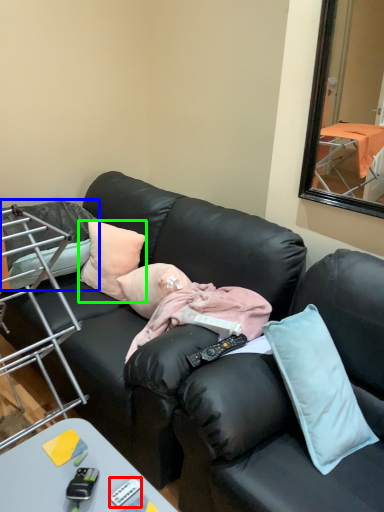
Question: Estimate the real-world distances between objects in this image. Which object is closer to remote control (highlighted by a red box), pillow (highlighted by a blue box) or pillow (highlighted by a green box)?

Choices:
 (A) pillow
 (B) pillow

Answer: (B)